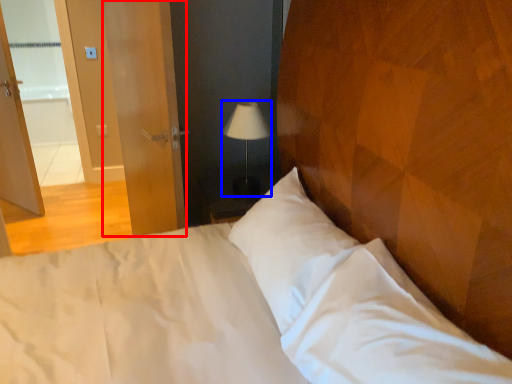
Question: Which point is further to the camera, screen door (highlighted by a red box) or lamp (highlighted by a blue box)?

Choices:
 (A) screen door
 (B) lamp

Answer: (B)